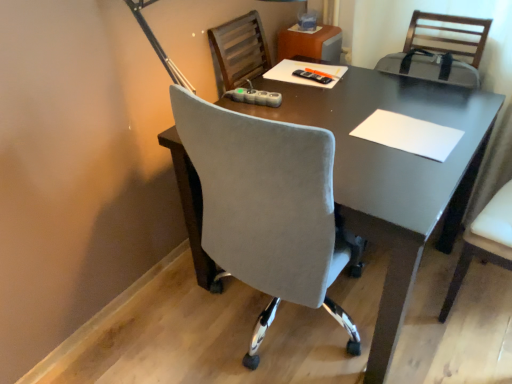
Question: Should I look upward or downward to see black plastic remote control at center?

Choices:
 (A) down
 (B) up

Answer: (B)

Question: Does white paper at center appear on the left side of white leather chair at right?

Choices:
 (A) no
 (B) yes

Answer: (B)

Question: Is white paper at center positioned far away from white leather chair at right?

Choices:
 (A) yes
 (B) no

Answer: (B)

Question: From the image's perspective, would you say white paper at center is positioned over white leather chair at right?

Choices:
 (A) no
 (B) yes

Answer: (B)

Question: Does white paper at center appear on the right side of white leather chair at right?

Choices:
 (A) yes
 (B) no

Answer: (B)

Question: Is white paper at center facing away from white leather chair at right?

Choices:
 (A) yes
 (B) no

Answer: (B)

Question: Does white paper at center turn towards white leather chair at right?

Choices:
 (A) yes
 (B) no

Answer: (A)

Question: From a real-world perspective, is black plastic remote control at center physically below white leather chair at right?

Choices:
 (A) yes
 (B) no

Answer: (B)

Question: Would you consider black plastic remote control at center to be distant from white leather chair at right?

Choices:
 (A) yes
 (B) no

Answer: (B)

Question: Can you confirm if black plastic remote control at center is positioned to the left of white leather chair at right?

Choices:
 (A) no
 (B) yes

Answer: (B)

Question: Considering the relative sizes of black plastic remote control at center and white leather chair at right in the image provided, is black plastic remote control at center wider than white leather chair at right?

Choices:
 (A) yes
 (B) no

Answer: (B)

Question: Is black plastic remote control at center outside white leather chair at right?

Choices:
 (A) no
 (B) yes

Answer: (B)

Question: Can you confirm if black plastic remote control at center is thinner than white leather chair at right?

Choices:
 (A) no
 (B) yes

Answer: (B)

Question: Is white paper at center at the back of black plastic remote control at center?

Choices:
 (A) yes
 (B) no

Answer: (B)